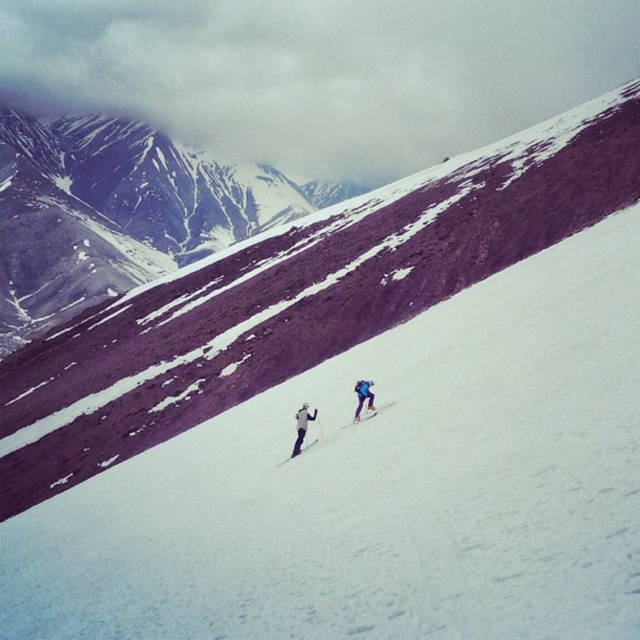
Question: Which point is closer to the camera?

Choices:
 (A) (115, 468)
 (B) (362, 394)
 (C) (298, 442)

Answer: (C)

Question: Does white snow at center have a greater width compared to blue fabric skier at center?

Choices:
 (A) no
 (B) yes

Answer: (B)

Question: Can you confirm if white snow at center is wider than blue fabric skier at center?

Choices:
 (A) no
 (B) yes

Answer: (B)

Question: Among these objects, which one is nearest to the camera?

Choices:
 (A) white matte skier at center
 (B) white matte ski at center

Answer: (A)

Question: Considering the real-world distances, which object is closest to the shiny blue ski at center?

Choices:
 (A) blue fabric skier at center
 (B) white matte ski at center

Answer: (A)

Question: Can you confirm if shiny blue ski at center is bigger than white matte ski at center?

Choices:
 (A) yes
 (B) no

Answer: (B)